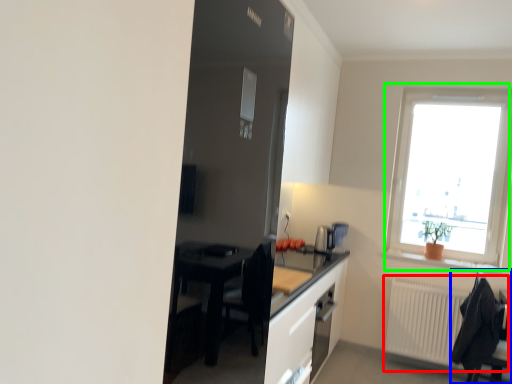
Question: Based on their relative distances, which object is farther from radiator (highlighted by a red box)? Choose from chair (highlighted by a blue box) and window (highlighted by a green box).

Choices:
 (A) chair
 (B) window

Answer: (B)